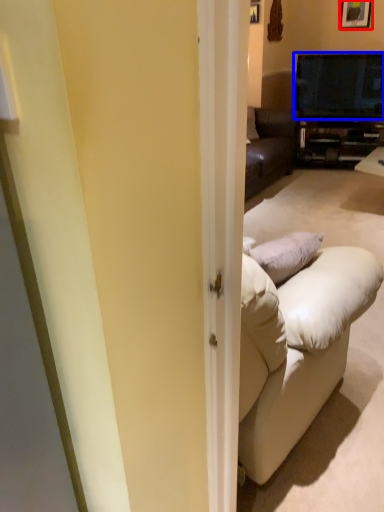
Question: Which object is further to the camera taking this photo, picture frame (highlighted by a red box) or television (highlighted by a blue box)?

Choices:
 (A) picture frame
 (B) television

Answer: (A)